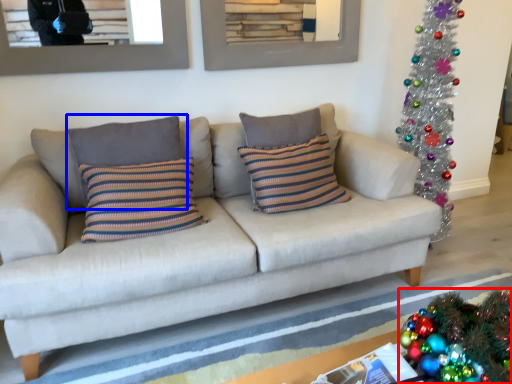
Question: Which of the following is the closest to the observer, christmas decoration (highlighted by a red box) or pillow (highlighted by a blue box)?

Choices:
 (A) christmas decoration
 (B) pillow

Answer: (A)